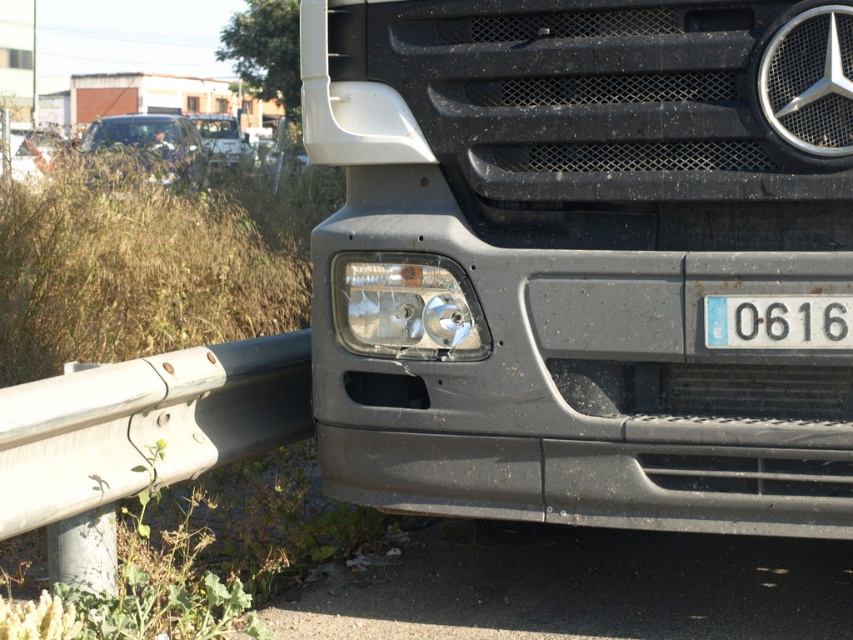
Question: Estimate the real-world distances between objects in this image. Which object is closer to the white plastic license plate at center?

Choices:
 (A) transparent plastic headlight at lower left
 (B) matte black truck at center
 (C) green leafy weed at lower left

Answer: (B)

Question: Does matte black truck at center appear on the left side of white plastic license plate at center?

Choices:
 (A) no
 (B) yes

Answer: (B)

Question: Which object is positioned closest to the white metallic rail at lower left?

Choices:
 (A) matte black truck at center
 (B) white plastic license plate at center
 (C) transparent plastic headlight at lower left
 (D) green leafy weed at lower left

Answer: (D)

Question: Is white metallic rail at lower left positioned at the back of white plastic license plate at center?

Choices:
 (A) no
 (B) yes

Answer: (A)

Question: Which object appears farthest from the camera in this image?

Choices:
 (A) matte black truck at center
 (B) white plastic license plate at center
 (C) white metallic rail at lower left
 (D) transparent plastic headlight at lower left

Answer: (D)

Question: Is matte black truck at center further to camera compared to green leafy weed at lower left?

Choices:
 (A) yes
 (B) no

Answer: (A)